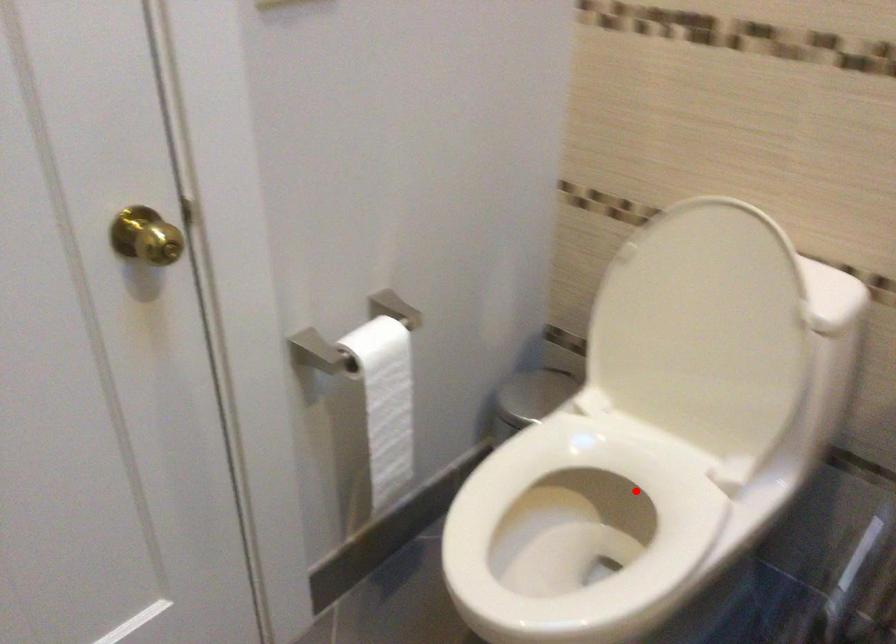
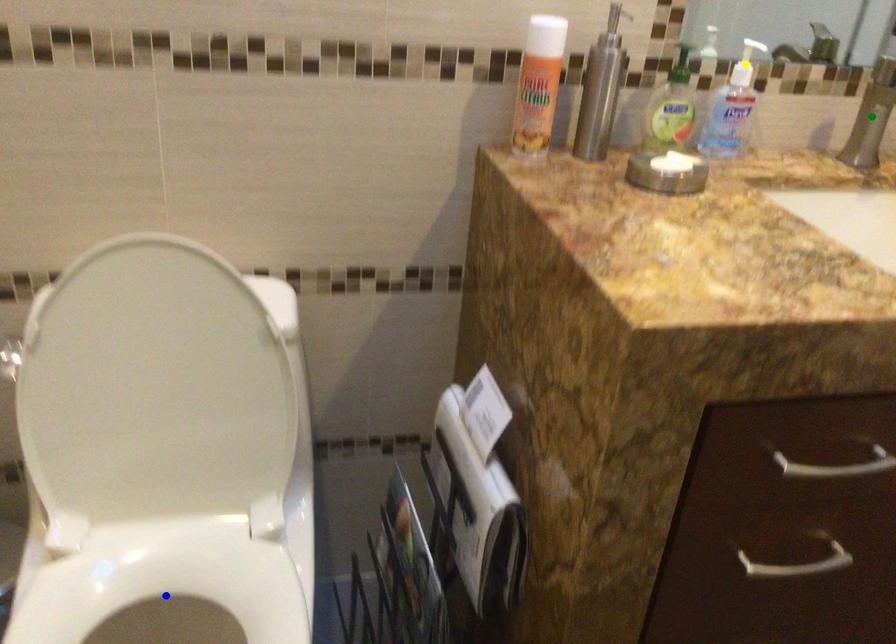
Question: I am providing you with two images of the same scene from different viewpoints. A red point is marked on the first image. You are given multiple points on the second image. In image 2, which mark is for the same physical point as the one in image 1?

Choices:
 (A) blue point
 (B) green point
 (C) yellow point

Answer: (A)